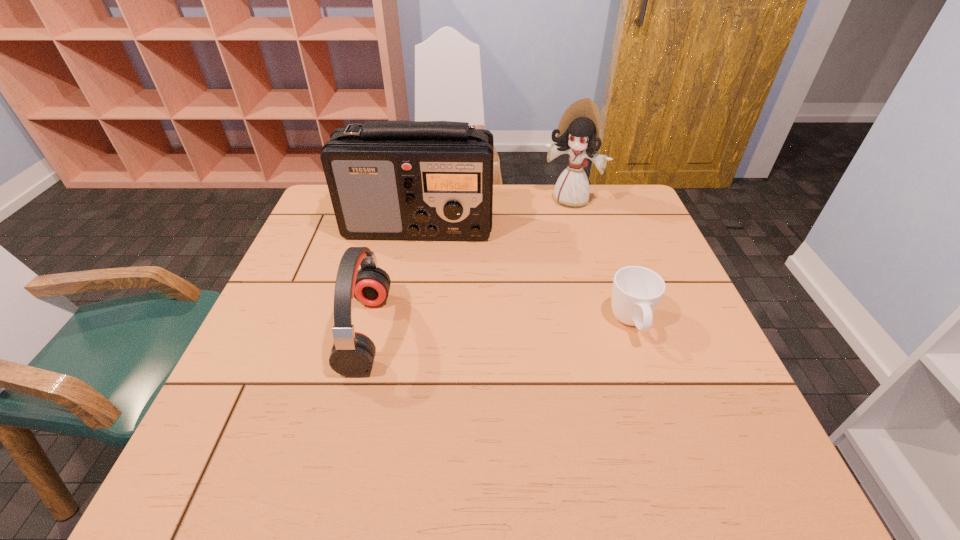
Image resolution: width=960 pixels, height=540 pixels. What are the coordinates of `vacant space that is in between the cup and the radio receiver` in the screenshot? It's located at (525, 275).

In order to click on free space between the shortest object and the second shortest object in this screenshot , I will do `click(499, 328)`.

Identify the location of free space between the doll and the shortest object. This screenshot has height=540, width=960. (601, 262).

Locate an element on the screen. The height and width of the screenshot is (540, 960). object that is the third nearest to the radio receiver is located at coordinates (636, 292).

Identify which object is the second closest to the radio receiver. Please provide its 2D coordinates. Your answer should be formatted as a tuple, i.e. [(x, y)], where the tuple contains the x and y coordinates of a point satisfying the conditions above.

[(352, 355)]

Where is `free space that satisfies the following two spatial constraints: 1. on the back side of the doll; 2. on the right side of the radio receiver`? The width and height of the screenshot is (960, 540). free space that satisfies the following two spatial constraints: 1. on the back side of the doll; 2. on the right side of the radio receiver is located at coordinates (423, 200).